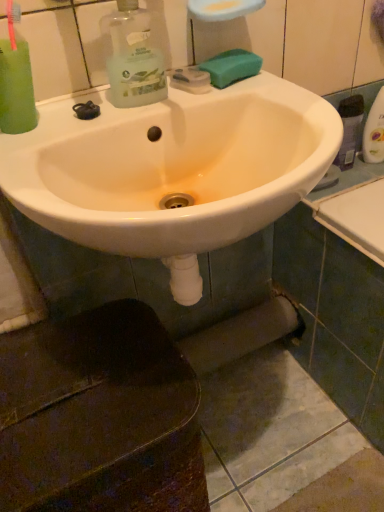
Where is `green sponge at upper right`? green sponge at upper right is located at coordinates [x=231, y=67].

Measure the distance between point [244,78] and camera.

Point [244,78] and camera are 29.25 inches apart from each other.

This screenshot has height=512, width=384. What do you see at coordinates (231, 67) in the screenshot?
I see `green sponge at upper right` at bounding box center [231, 67].

Where is `white glossy sink at center`? white glossy sink at center is located at coordinates (172, 170).

The width and height of the screenshot is (384, 512). What do you see at coordinates (172, 170) in the screenshot?
I see `white glossy sink at center` at bounding box center [172, 170].

Where is `green sponge at upper right`? This screenshot has width=384, height=512. green sponge at upper right is located at coordinates (231, 67).

Which object is positioned more to the right, white glossy sink at center or green sponge at upper right?

green sponge at upper right is more to the right.

Is white glossy sink at center closer to camera compared to green sponge at upper right?

Yes, white glossy sink at center is closer to the viewer.

Does point (244, 233) lie behind point (228, 70)?

No, it is in front of (228, 70).

From the image's perspective, which one is positioned lower, white glossy sink at center or green sponge at upper right?

white glossy sink at center.

From a real-world perspective, is white glossy sink at center below green sponge at upper right?

Indeed, from a real-world perspective, white glossy sink at center is positioned beneath green sponge at upper right.

Which of these two, white glossy sink at center or green sponge at upper right, is thinner?

Thinner between the two is green sponge at upper right.

Considering the sizes of objects white glossy sink at center and green sponge at upper right in the image provided, who is shorter, white glossy sink at center or green sponge at upper right?

green sponge at upper right is shorter.

Between white glossy sink at center and green sponge at upper right, which one has larger size?

white glossy sink at center.

Is white glossy sink at center not within green sponge at upper right?

Absolutely, white glossy sink at center is external to green sponge at upper right.

Is white glossy sink at center far away from green sponge at upper right?

white glossy sink at center is near green sponge at upper right, not far away.

Does white glossy sink at center turn towards green sponge at upper right?

No, white glossy sink at center is not aimed at green sponge at upper right.

Can you tell me how much white glossy sink at center and green sponge at upper right differ in facing direction?

They differ by 0.000426 degrees in their facing directions.

Locate an element on the screen. The height and width of the screenshot is (512, 384). sink located in front of the green sponge at upper right is located at coordinates (172, 170).

Considering the relative positions of green sponge at upper right and white glossy sink at center in the image provided, is green sponge at upper right to the left or to the right of white glossy sink at center?

green sponge at upper right is positioned on white glossy sink at center's right side.

Consider the image. Which object is further away from the camera taking this photo, green sponge at upper right or white glossy sink at center?

green sponge at upper right is more distant.

Which is behind, point (236, 52) or point (120, 248)?

The point (236, 52) is farther.

From the image's perspective, is green sponge at upper right above white glossy sink at center?

Yes, from the image's perspective, green sponge at upper right is above white glossy sink at center.

From a real-world perspective, which object stands above the other?

From a 3D spatial view, green sponge at upper right is above.

Considering the sizes of objects green sponge at upper right and white glossy sink at center in the image provided, who is thinner, green sponge at upper right or white glossy sink at center?

Thinner between the two is green sponge at upper right.

Considering the relative sizes of green sponge at upper right and white glossy sink at center in the image provided, is green sponge at upper right taller than white glossy sink at center?

In fact, green sponge at upper right may be shorter than white glossy sink at center.

Looking at the image, does green sponge at upper right seem bigger or smaller compared to white glossy sink at center?

Considering their sizes, green sponge at upper right takes up less space than white glossy sink at center.

Would you say green sponge at upper right contains white glossy sink at center?

That's incorrect, white glossy sink at center is not inside green sponge at upper right.

Is green sponge at upper right touching white glossy sink at center?

No, green sponge at upper right is not with white glossy sink at center.

Could you tell me if green sponge at upper right is facing white glossy sink at center?

No, green sponge at upper right is not oriented towards white glossy sink at center.

Consider the image. Measure the distance from green sponge at upper right to white glossy sink at center.

green sponge at upper right and white glossy sink at center are 21.77 centimeters apart from each other.

The width and height of the screenshot is (384, 512). Find the location of `soap above the white glossy sink at center (from the image's perspective)`. soap above the white glossy sink at center (from the image's perspective) is located at coordinates (231, 67).

You are a GUI agent. You are given a task and a screenshot of the screen. Output one action in this format:
    pyautogui.click(x=<x>, y=<y>)
    Task: Click on the sink below the green sponge at upper right (from a real-world perspective)
    This screenshot has height=512, width=384.
    Given the screenshot: What is the action you would take?
    pyautogui.click(x=172, y=170)

Locate an element on the screen. The width and height of the screenshot is (384, 512). soap lying on the right of white glossy sink at center is located at coordinates (231, 67).